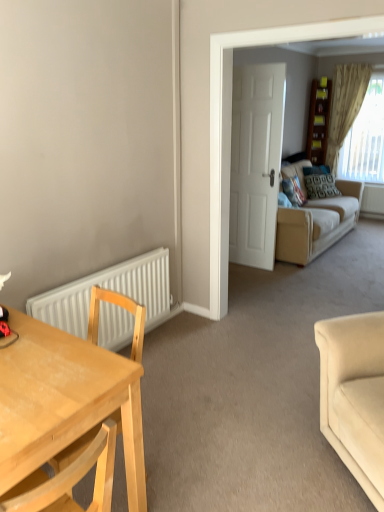
What do you see at coordinates (354, 395) in the screenshot? The height and width of the screenshot is (512, 384). I see `beige fabric couch at right, the first studio couch in the bottom-to-top sequence` at bounding box center [354, 395].

What do you see at coordinates (110, 289) in the screenshot? The image size is (384, 512). I see `white matte radiator at lower left` at bounding box center [110, 289].

The image size is (384, 512). I want to click on beige fabric couch at right, arranged as the second studio couch when ordered from the bottom, so click(x=317, y=224).

What do you see at coordinates (64, 401) in the screenshot?
I see `light wood desk at left` at bounding box center [64, 401].

Image resolution: width=384 pixels, height=512 pixels. Describe the element at coordinates (256, 162) in the screenshot. I see `white matte door at center` at that location.

This screenshot has width=384, height=512. What do you see at coordinates (345, 106) in the screenshot?
I see `beige textured curtain at upper right` at bounding box center [345, 106].

Where is `velvet blue pillow at center-right, arranged as the 1th pillow when viewed from the left`? The image size is (384, 512). velvet blue pillow at center-right, arranged as the 1th pillow when viewed from the left is located at coordinates (293, 191).

The width and height of the screenshot is (384, 512). What do you see at coordinates (319, 182) in the screenshot?
I see `patterned fabric pillow at center, positioned as the 2th pillow in left-to-right order` at bounding box center [319, 182].

Find the location of a particular element. This screenshot has width=384, height=512. beige fabric couch at right, the 2th studio couch from the back is located at coordinates (354, 395).

Is beige textured curtain at upper right looking in the opposite direction of light wood desk at left?

beige textured curtain at upper right is not turned away from light wood desk at left.

From a real-world perspective, is beige textured curtain at upper right located beneath light wood desk at left?

Actually, beige textured curtain at upper right is physically above light wood desk at left in the real world.

Is beige textured curtain at upper right located outside light wood desk at left?

Indeed, beige textured curtain at upper right is completely outside light wood desk at left.

Is point (348, 115) closer to camera compared to point (131, 371)?

No, it is behind (131, 371).

From a real-world perspective, which is physically below, beige fabric couch at right, arranged as the second studio couch when viewed from the front, or light wood desk at left?

light wood desk at left is physically lower.

Is beige fabric couch at right, the first studio couch when ordered from back to front, at the right side of light wood desk at left?

Indeed, beige fabric couch at right, the first studio couch when ordered from back to front, is positioned on the right side of light wood desk at left.

Which object is further away from the camera taking this photo, beige fabric couch at right, arranged as the second studio couch when viewed from the front, or light wood desk at left?

beige fabric couch at right, arranged as the second studio couch when viewed from the front, is more distant.

Is beige fabric couch at right, placed as the 1th studio couch when sorted from top to bottom, turned away from light wood desk at left?

No, beige fabric couch at right, placed as the 1th studio couch when sorted from top to bottom, is not facing the opposite direction of light wood desk at left.

Would you say velvet blue pillow at center-right, which is the second pillow in back-to-front order, contains light wood desk at left?

No, velvet blue pillow at center-right, which is the second pillow in back-to-front order, does not contain light wood desk at left.

Can you tell me how much velvet blue pillow at center-right, positioned as the 1th pillow in front-to-back order, and light wood desk at left differ in facing direction?

The angular difference between velvet blue pillow at center-right, positioned as the 1th pillow in front-to-back order, and light wood desk at left is 3.69 degrees.

Where is `desk that is under the velvet blue pillow at center-right, the second pillow when ordered from right to left (from a real-world perspective)`? The image size is (384, 512). desk that is under the velvet blue pillow at center-right, the second pillow when ordered from right to left (from a real-world perspective) is located at coordinates (64, 401).

Does velvet blue pillow at center-right, which is the second pillow in back-to-front order, have a lesser height compared to light wood desk at left?

Correct, velvet blue pillow at center-right, which is the second pillow in back-to-front order, is not as tall as light wood desk at left.

Considering the sizes of objects beige fabric couch at right, the first studio couch in the bottom-to-top sequence, and velvet blue pillow at center-right, positioned as the 1th pillow in front-to-back order, in the image provided, who is smaller, beige fabric couch at right, the first studio couch in the bottom-to-top sequence, or velvet blue pillow at center-right, positioned as the 1th pillow in front-to-back order,?

velvet blue pillow at center-right, positioned as the 1th pillow in front-to-back order, is smaller.

How many degrees apart are the facing directions of beige fabric couch at right, the 2th studio couch from the back, and velvet blue pillow at center-right, the second pillow when ordered from right to left?

beige fabric couch at right, the 2th studio couch from the back, and velvet blue pillow at center-right, the second pillow when ordered from right to left, are facing 129 degrees away from each other.

Is there a large distance between beige fabric couch at right, which is counted as the 1th studio couch, starting from the front, and velvet blue pillow at center-right, positioned as the 1th pillow in front-to-back order?

Yes.

Is beige fabric couch at right, which is counted as the 1th studio couch, starting from the front, to the right of velvet blue pillow at center-right, positioned as the 1th pillow in front-to-back order, from the viewer's perspective?

No.

In the image, is white matte radiator at lower left positioned in front of or behind patterned fabric pillow at center, the second pillow when ordered from front to back?

white matte radiator at lower left is positioned closer to the viewer than patterned fabric pillow at center, the second pillow when ordered from front to back.

From a real-world perspective, is white matte radiator at lower left on top of patterned fabric pillow at center, which appears as the 1th pillow when viewed from the right?

Incorrect, from a real-world perspective, white matte radiator at lower left is lower than patterned fabric pillow at center, which appears as the 1th pillow when viewed from the right.

Is white matte radiator at lower left positioned beyond the bounds of patterned fabric pillow at center, positioned as the 2th pillow in left-to-right order?

Absolutely, white matte radiator at lower left is external to patterned fabric pillow at center, positioned as the 2th pillow in left-to-right order.

Does point (14, 329) lie in front of point (123, 266)?

Yes, it is.

From their relative heights in the image, would you say light wood desk at left is taller or shorter than white matte radiator at lower left?

Considering their sizes, light wood desk at left has more height than white matte radiator at lower left.

Is light wood desk at left positioned with its back to white matte radiator at lower left?

No, light wood desk at left's orientation is not away from white matte radiator at lower left.

Identify the location of cabinetry located above the beige fabric couch at right, positioned as the second studio couch in top-to-bottom order (from the image's perspective). (318, 122).

From the picture: Which point is more distant from viewer, (319, 121) or (358, 417)?

Positioned behind is point (319, 121).

Are wooden bookshelf at upper right and beige fabric couch at right, positioned as the second studio couch in top-to-bottom order, making contact?

No, wooden bookshelf at upper right is not touching beige fabric couch at right, positioned as the second studio couch in top-to-bottom order.

In the scene shown: Is wooden bookshelf at upper right situated inside beige fabric couch at right, which is counted as the 1th studio couch, starting from the front, or outside?

wooden bookshelf at upper right is not inside beige fabric couch at right, which is counted as the 1th studio couch, starting from the front, it's outside.

The width and height of the screenshot is (384, 512). What are the coordinates of `curtain located above the light wood desk at left (from a real-world perspective)` in the screenshot? It's located at (345, 106).

Locate an element on the screen. desk below the beige fabric couch at right, arranged as the second studio couch when ordered from the bottom (from the image's perspective) is located at coordinates 64,401.

From the image, which object appears to be farther from beige fabric couch at right, the first studio couch when ordered from back to front, beige fabric couch at right, the 2th studio couch from the back, or light wood desk at left?

Based on the image, light wood desk at left appears to be further to beige fabric couch at right, the first studio couch when ordered from back to front.

Looking at this image, based on their spatial positions, is white matte radiator at lower left or light wood desk at left closer to velvet blue pillow at center-right, which is the second pillow in back-to-front order?

Based on the image, white matte radiator at lower left appears to be nearer to velvet blue pillow at center-right, which is the second pillow in back-to-front order.

Considering their positions, is beige fabric couch at right, positioned as the second studio couch in top-to-bottom order, positioned closer to wooden bookshelf at upper right than white matte radiator at lower left?

white matte radiator at lower left.

Looking at the image, which one is located further to velvet blue pillow at center-right, which is the second pillow in back-to-front order, beige fabric couch at right, the first studio couch in the bottom-to-top sequence, or wooden bookshelf at upper right?

beige fabric couch at right, the first studio couch in the bottom-to-top sequence, is further to velvet blue pillow at center-right, which is the second pillow in back-to-front order.

Consider the image. Estimate the real-world distances between objects in this image. Which object is further from patterned fabric pillow at center, which appears as the 1th pillow when viewed from the right, light wood desk at left or beige fabric couch at right, the first studio couch when ordered from back to front?

Based on the image, light wood desk at left appears to be further to patterned fabric pillow at center, which appears as the 1th pillow when viewed from the right.

Considering their positions, is white matte door at center positioned further to wooden bookshelf at upper right than beige fabric couch at right, placed as the 1th studio couch when sorted from top to bottom?

white matte door at center is further to wooden bookshelf at upper right.

Looking at the image, which one is located further to velvet blue pillow at center-right, the second pillow when ordered from right to left, light wood desk at left or beige textured curtain at upper right?

light wood desk at left.

Which object lies further to the anchor point beige fabric couch at right, the 2th studio couch from the back, wooden bookshelf at upper right or white matte radiator at lower left?

wooden bookshelf at upper right is positioned further to the anchor beige fabric couch at right, the 2th studio couch from the back.

Where is `radiator between light wood desk at left and beige fabric couch at right, which is counted as the 1th studio couch, starting from the front, from left to right`? The width and height of the screenshot is (384, 512). radiator between light wood desk at left and beige fabric couch at right, which is counted as the 1th studio couch, starting from the front, from left to right is located at coordinates (110, 289).

Where is `pillow between beige textured curtain at upper right and velvet blue pillow at center-right, arranged as the 1th pillow when viewed from the left, in the vertical direction`? This screenshot has width=384, height=512. pillow between beige textured curtain at upper right and velvet blue pillow at center-right, arranged as the 1th pillow when viewed from the left, in the vertical direction is located at coordinates (319, 182).

Where is `door positioned between beige fabric couch at right, which is counted as the 1th studio couch, starting from the front, and beige fabric couch at right, placed as the 1th studio couch when sorted from top to bottom, from near to far`? door positioned between beige fabric couch at right, which is counted as the 1th studio couch, starting from the front, and beige fabric couch at right, placed as the 1th studio couch when sorted from top to bottom, from near to far is located at coordinates (256, 162).

At what (x,y) coordinates should I click in order to perform the action: click on studio couch between white matte door at center and patterned fabric pillow at center, the second pillow when ordered from front to back, along the z-axis. Please return your answer as a coordinate pair (x, y). Image resolution: width=384 pixels, height=512 pixels. Looking at the image, I should click on (317, 224).